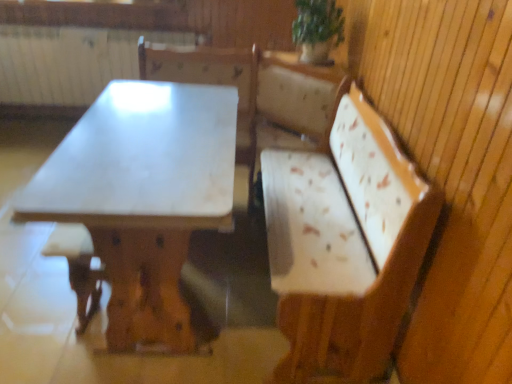
Identify the location of vacant space to the left of brown wood step stool at lower left. The image size is (512, 384). pyautogui.click(x=40, y=309).